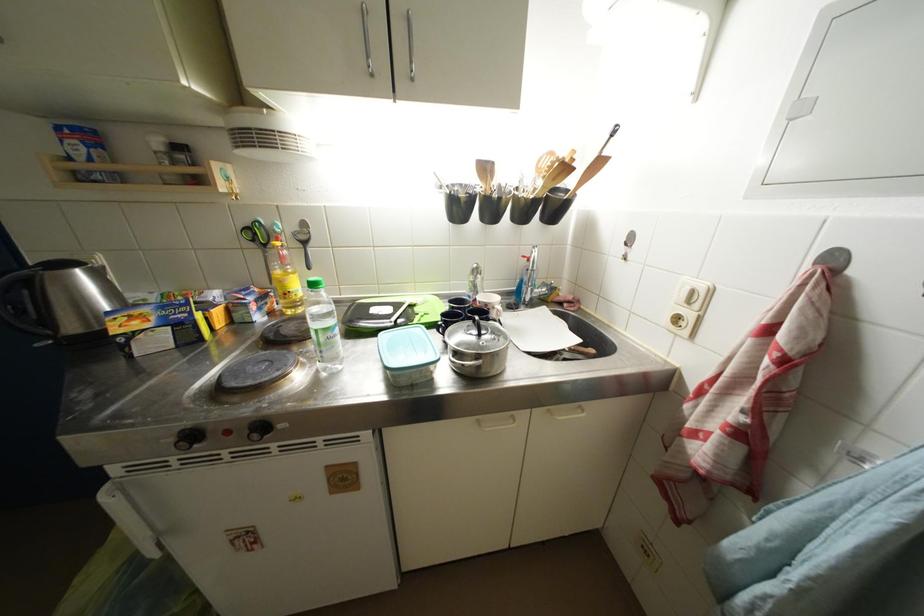
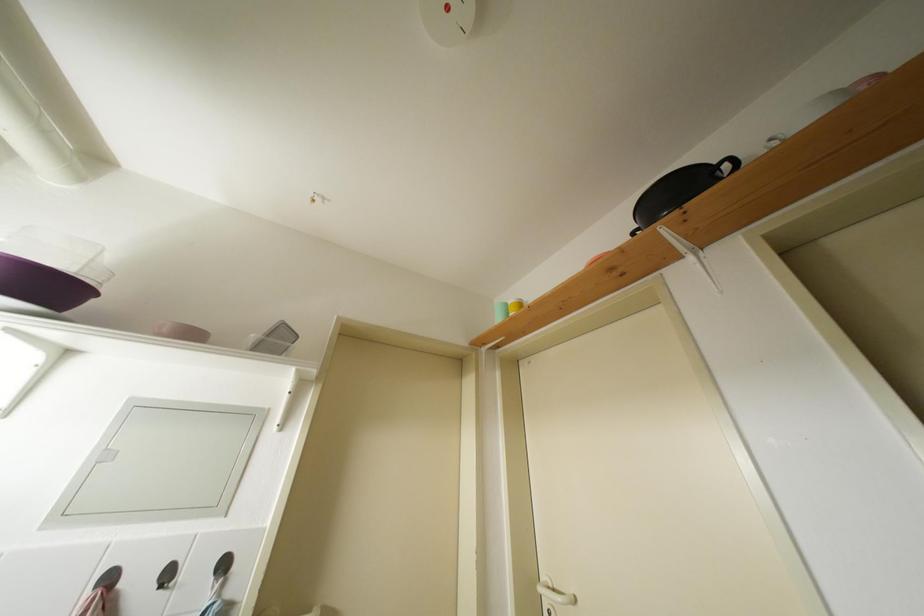
Based on the photo, how did the camera likely rotate?

The camera's rotation is toward right-up.